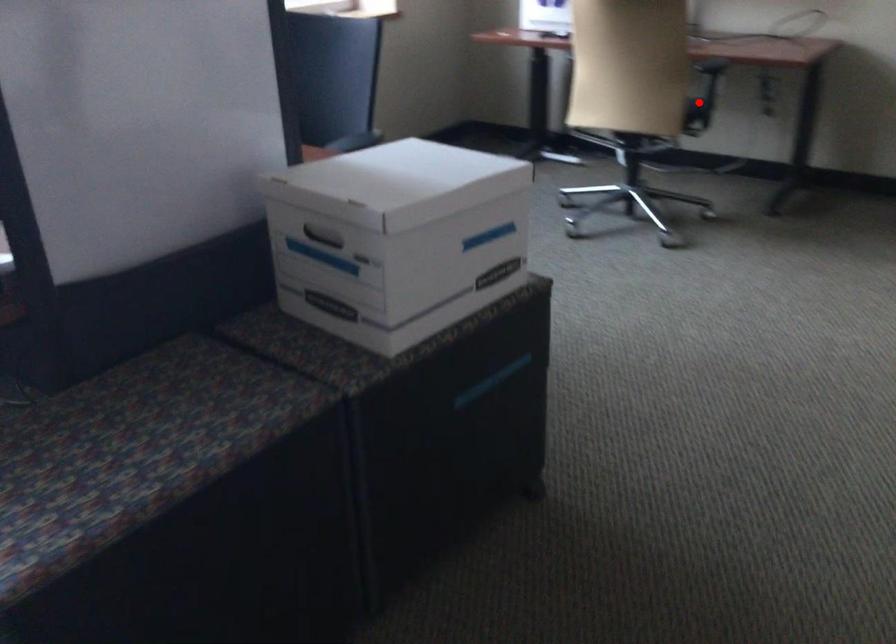
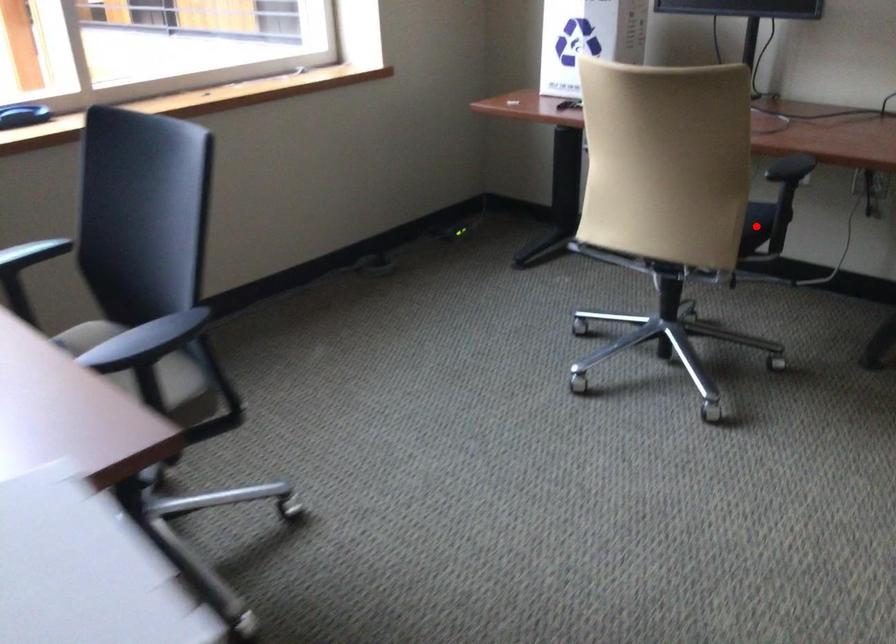
I am providing you with two images of the same scene from different viewpoints. A red point is marked on the first image and another point is marked on the second image. Does the point marked in image1 correspond to the same location as the one in image2?

Yes